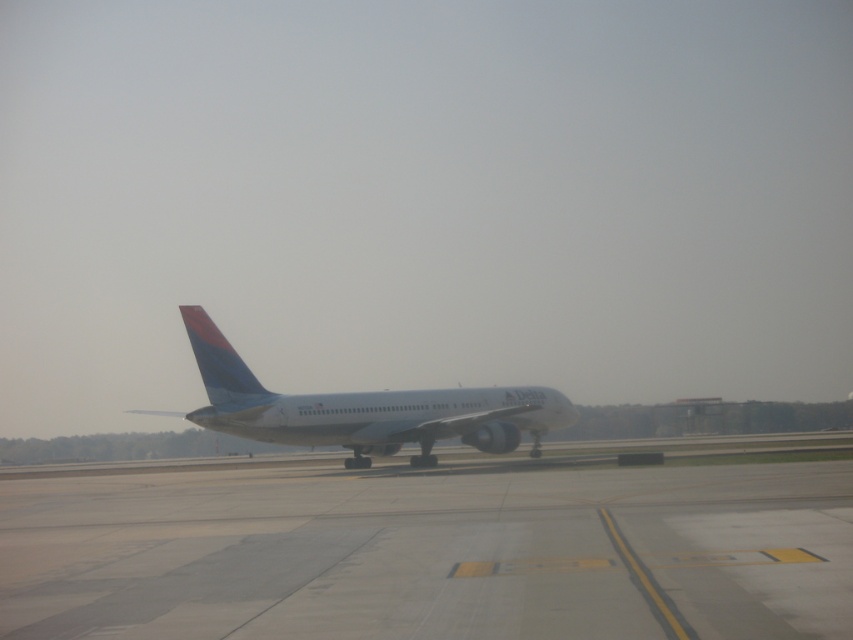
You are a pilot preparing to taxi the white glossy airplane at center from its current position to the terminal. The terminal is located behind the gray concrete tarmac at center. Can the airplane safely move backward without hitting the tarmac?

The gray concrete tarmac at center and white glossy airplane at center are 10.94 meters apart. Since the airplane needs to move backward towards the terminal, the 10.94 meters of space between them should be sufficient for safe maneuvering as long as the pilot maintains control and there are no obstructions.